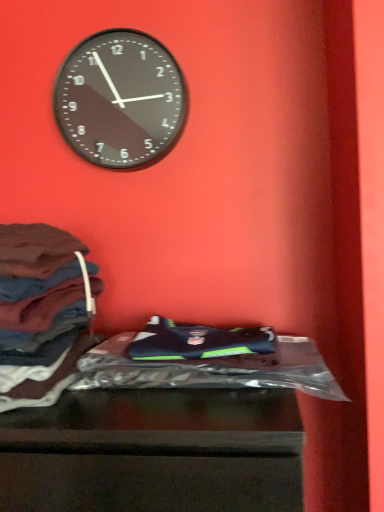
What is the approximate width of shiny plastic bag at center?

It is 13.29 inches.

What do you see at coordinates (43, 313) in the screenshot? I see `dark brown fabric at left` at bounding box center [43, 313].

Describe the element at coordinates (154, 452) in the screenshot. I see `shiny plastic bag at lower center` at that location.

Identify the location of shiny plastic bag at lower center. Image resolution: width=384 pixels, height=512 pixels. (154, 452).

Locate an element on the screen. Image resolution: width=384 pixels, height=512 pixels. shiny plastic bag at center is located at coordinates (212, 370).

Considering the sizes of objects shiny plastic bag at lower center and black glass clock at upper center in the image provided, who is taller, shiny plastic bag at lower center or black glass clock at upper center?

Standing taller between the two is shiny plastic bag at lower center.

Is shiny plastic bag at lower center facing towards black glass clock at upper center?

No, shiny plastic bag at lower center is not facing towards black glass clock at upper center.

From the image's perspective, which object appears higher, shiny plastic bag at lower center or black glass clock at upper center?

From the image's view, black glass clock at upper center is above.

Is shiny plastic bag at lower center spatially inside black glass clock at upper center, or outside of it?

shiny plastic bag at lower center is outside black glass clock at upper center.

Measure the distance from shiny plastic bag at center to shiny plastic bag at lower center.

They are 6.02 inches apart.

Where is `furniture lying below the shiny plastic bag at center (from the image's perspective)`? furniture lying below the shiny plastic bag at center (from the image's perspective) is located at coordinates (154, 452).

Is shiny plastic bag at center not inside shiny plastic bag at lower center?

That's incorrect, shiny plastic bag at center is not completely outside shiny plastic bag at lower center.

Is shiny plastic bag at center placed right next to shiny plastic bag at lower center?

No, shiny plastic bag at center is not next to shiny plastic bag at lower center.

From the image's perspective, is black glass clock at upper center beneath dark brown fabric at left?

No.

Between black glass clock at upper center and dark brown fabric at left, which one has smaller width?

With smaller width is black glass clock at upper center.

From a real-world perspective, is dark brown fabric at left over black glass clock at upper center?

No.

Is dark brown fabric at left taller than black glass clock at upper center?

Incorrect, the height of dark brown fabric at left is not larger of that of black glass clock at upper center.

Considering the relative sizes of dark brown fabric at left and black glass clock at upper center in the image provided, is dark brown fabric at left thinner than black glass clock at upper center?

No.

Is dark brown fabric at left aimed at black glass clock at upper center?

No, dark brown fabric at left is not turned towards black glass clock at upper center.

Considering the sizes of objects black glass clock at upper center and shiny plastic bag at center in the image provided, who is bigger, black glass clock at upper center or shiny plastic bag at center?

With larger size is shiny plastic bag at center.

From the image's perspective, would you say black glass clock at upper center is shown under shiny plastic bag at center?

No, from the image's perspective, black glass clock at upper center is not beneath shiny plastic bag at center.

I want to click on material directly beneath the black glass clock at upper center (from a real-world perspective), so click(x=212, y=370).

From a real-world perspective, is black glass clock at upper center over shiny plastic bag at center?

Yes, from a real-world perspective, black glass clock at upper center is above shiny plastic bag at center.

How much distance is there between shiny plastic bag at center and dark brown fabric at left?

A distance of 8.21 inches exists between shiny plastic bag at center and dark brown fabric at left.

Which object is positioned more to the left, shiny plastic bag at center or dark brown fabric at left?

From the viewer's perspective, dark brown fabric at left appears more on the left side.

The image size is (384, 512). I want to click on material that appears on the right of dark brown fabric at left, so click(x=212, y=370).

From the image's perspective, relative to dark brown fabric at left, is shiny plastic bag at center above or below?

Based on their image positions, shiny plastic bag at center is located beneath dark brown fabric at left.

Who is taller, dark brown fabric at left or shiny plastic bag at lower center?

shiny plastic bag at lower center is taller.

Is dark brown fabric at left directly adjacent to shiny plastic bag at lower center?

No, dark brown fabric at left is not next to shiny plastic bag at lower center.

From the image's perspective, is dark brown fabric at left under shiny plastic bag at lower center?

Actually, dark brown fabric at left appears above shiny plastic bag at lower center in the image.

Locate an element on the screen. Image resolution: width=384 pixels, height=512 pixels. furniture below the black glass clock at upper center (from the image's perspective) is located at coordinates (154, 452).

Find the location of a particular element. Image resolution: width=384 pixels, height=512 pixels. furniture located on the left of shiny plastic bag at center is located at coordinates (154, 452).

Based on their spatial positions, is black glass clock at upper center or shiny plastic bag at center further from dark brown fabric at left?

black glass clock at upper center lies further to dark brown fabric at left than the other object.

From the image, which object appears to be nearer to dark brown fabric at left, shiny plastic bag at center or shiny plastic bag at lower center?

Based on the image, shiny plastic bag at center appears to be nearer to dark brown fabric at left.

Estimate the real-world distances between objects in this image. Which object is closer to dark brown fabric at left, shiny plastic bag at lower center or black glass clock at upper center?

Among the two, shiny plastic bag at lower center is located nearer to dark brown fabric at left.

Looking at the image, which one is located further to black glass clock at upper center, shiny plastic bag at center or dark brown fabric at left?

The object further to black glass clock at upper center is shiny plastic bag at center.

Based on their spatial positions, is shiny plastic bag at lower center or dark brown fabric at left closer to shiny plastic bag at center?

Based on the image, shiny plastic bag at lower center appears to be nearer to shiny plastic bag at center.

Considering their positions, is dark brown fabric at left positioned further to shiny plastic bag at lower center than black glass clock at upper center?

black glass clock at upper center is positioned further to the anchor shiny plastic bag at lower center.

Looking at the image, which one is located closer to dark brown fabric at left, shiny plastic bag at center or black glass clock at upper center?

shiny plastic bag at center is positioned closer to the anchor dark brown fabric at left.

Which object lies further to the anchor point black glass clock at upper center, dark brown fabric at left or shiny plastic bag at center?

The object further to black glass clock at upper center is shiny plastic bag at center.

I want to click on material between dark brown fabric at left and shiny plastic bag at lower center vertically, so click(x=212, y=370).

I want to click on clothing between black glass clock at upper center and shiny plastic bag at lower center in the vertical direction, so click(x=43, y=313).

At what (x,y) coordinates should I click in order to perform the action: click on clothing that lies between black glass clock at upper center and shiny plastic bag at center from top to bottom. Please return your answer as a coordinate pair (x, y). This screenshot has height=512, width=384. Looking at the image, I should click on tap(43, 313).

Where is `material between black glass clock at upper center and shiny plastic bag at lower center vertically`? Image resolution: width=384 pixels, height=512 pixels. material between black glass clock at upper center and shiny plastic bag at lower center vertically is located at coordinates (212, 370).